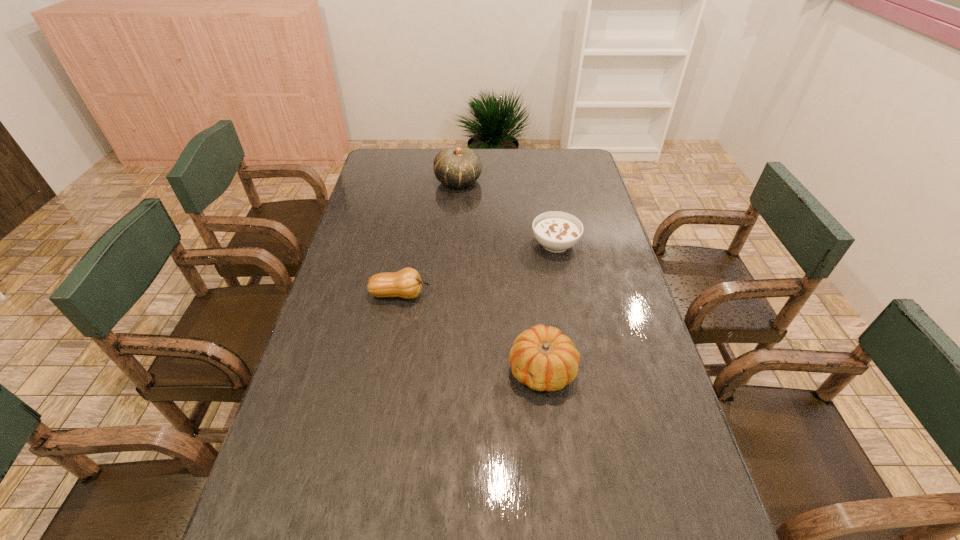
You are a GUI agent. You are given a task and a screenshot of the screen. Output one action in this format:
    pyautogui.click(x=<x>, y=<y>)
    Task: Click on the free space located 0.180m on the stem side of the shortest gourd
    The height and width of the screenshot is (540, 960).
    Given the screenshot: What is the action you would take?
    pyautogui.click(x=492, y=294)

You are a GUI agent. You are given a task and a screenshot of the screen. Output one action in this format:
    pyautogui.click(x=<x>, y=<y>)
    Task: Click on the vacant space located on the back of the soup bowl
    
    Given the screenshot: What is the action you would take?
    pyautogui.click(x=544, y=185)

Locate an element on the screen. The image size is (960, 540). object at the far edge is located at coordinates (457, 167).

Image resolution: width=960 pixels, height=540 pixels. What are the coordinates of `object located in the left edge section of the desktop` in the screenshot? It's located at (406, 283).

Where is `object present at the right edge`? This screenshot has width=960, height=540. object present at the right edge is located at coordinates (556, 231).

The width and height of the screenshot is (960, 540). Identify the location of vacant space at the far edge. (430, 150).

This screenshot has height=540, width=960. What are the coordinates of `vacant space at the left edge` in the screenshot? It's located at (359, 273).

You are a GUI agent. You are given a task and a screenshot of the screen. Output one action in this format:
    pyautogui.click(x=<x>, y=<y>)
    Task: Click on the vacant space at the right edge
    This screenshot has width=960, height=540.
    Given the screenshot: What is the action you would take?
    pyautogui.click(x=602, y=390)

Locate an element on the screen. The height and width of the screenshot is (540, 960). blank space at the far left corner of the desktop is located at coordinates (384, 153).

Locate an element on the screen. The height and width of the screenshot is (540, 960). free spot between the rightmost gourd and the second shortest object is located at coordinates (471, 332).